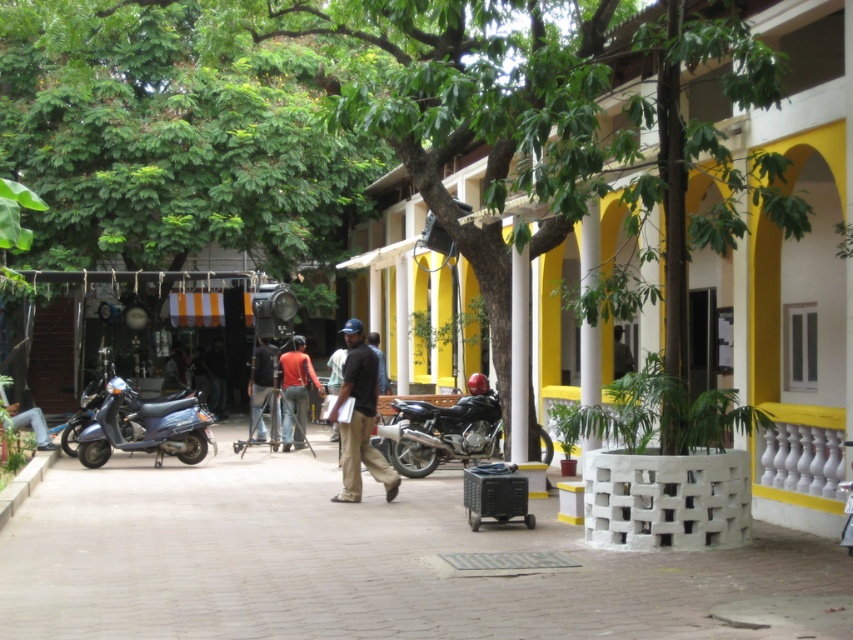
In the scene shown: You are standing at the center of the courtyard and want to move towards the green leafy tree at center. Which direction should you move?

Since the green leafy tree at center is located at point [395,115], you should move towards the lower left direction from the center to reach it.